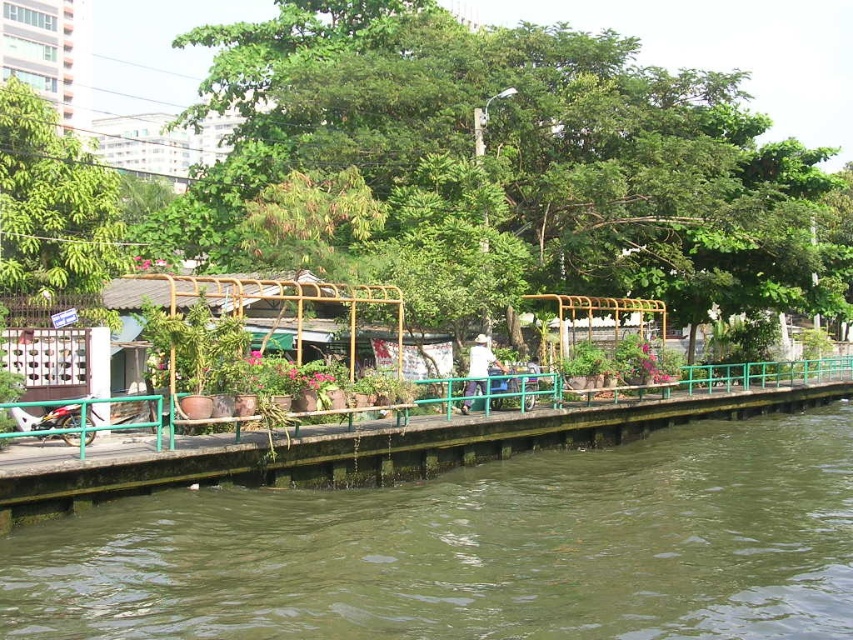
Question: Which of these objects is positioned closest to the green leafy tree at center?

Choices:
 (A) green wooden dock at center
 (B) green murky water at lower left

Answer: (A)

Question: Can you confirm if green leafy tree at center is thinner than green wooden dock at center?

Choices:
 (A) yes
 (B) no

Answer: (B)

Question: Can you confirm if green leafy tree at center is bigger than white fabric at center?

Choices:
 (A) no
 (B) yes

Answer: (B)

Question: Which of these objects is positioned farthest from the green leafy tree at upper left?

Choices:
 (A) white fabric at center
 (B) green leafy tree at center
 (C) green murky water at lower left
 (D) green wooden dock at center

Answer: (D)

Question: Is green wooden dock at center below green leafy tree at upper left?

Choices:
 (A) no
 (B) yes

Answer: (B)

Question: Estimate the real-world distances between objects in this image. Which object is closer to the green murky water at lower left?

Choices:
 (A) white fabric at center
 (B) green leafy tree at center
 (C) green leafy tree at upper left
 (D) green wooden dock at center

Answer: (D)